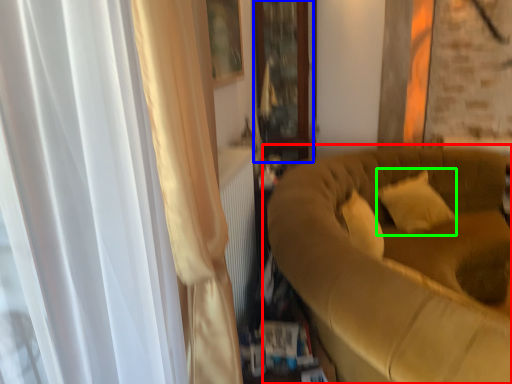
Question: Which object is positioned farthest from studio couch (highlighted by a red box)? Select from glass door (highlighted by a blue box) and pillow (highlighted by a green box).

Choices:
 (A) glass door
 (B) pillow

Answer: (A)